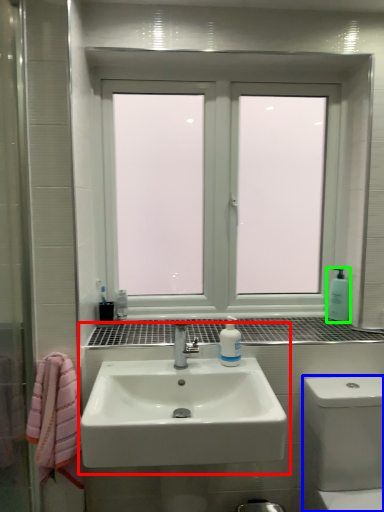
Question: Estimate the real-world distances between objects in this image. Which object is closer to sink (highlighted by a red box), bath (highlighted by a blue box) or soap dispenser (highlighted by a green box)?

Choices:
 (A) bath
 (B) soap dispenser

Answer: (A)